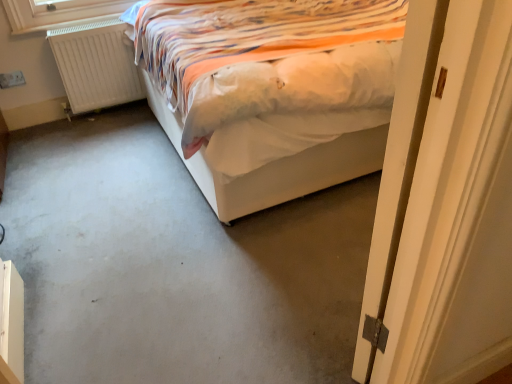
Identify the location of free space above gray carpet at center (from a real-world perspective). (138, 193).